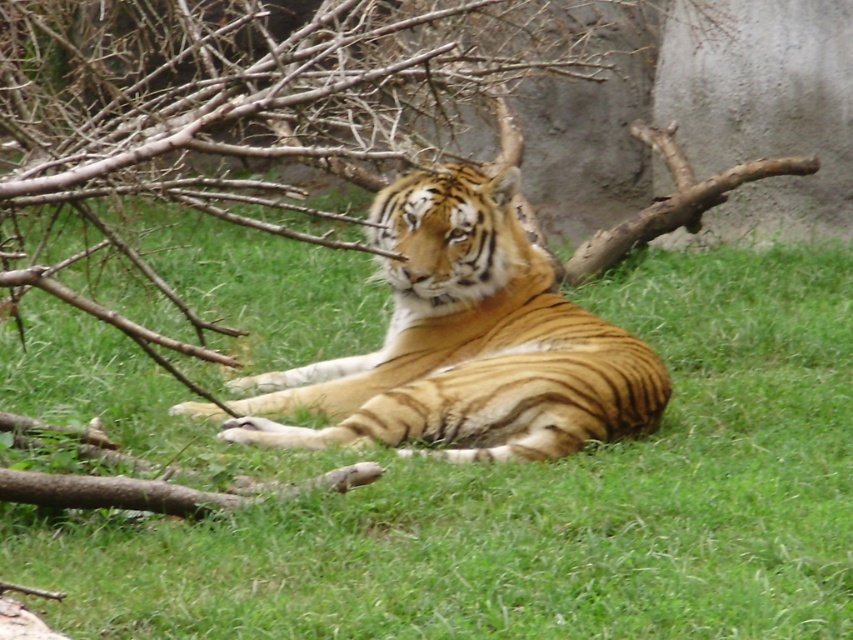
Is green grass at center smaller than golden fur tiger at center?

Incorrect, green grass at center is not smaller in size than golden fur tiger at center.

Is green grass at center shorter than golden fur tiger at center?

No.

Who is more distant from viewer, (407, 624) or (636, 420)?

The point (636, 420) is behind.

The image size is (853, 640). Identify the location of green grass at center. (491, 488).